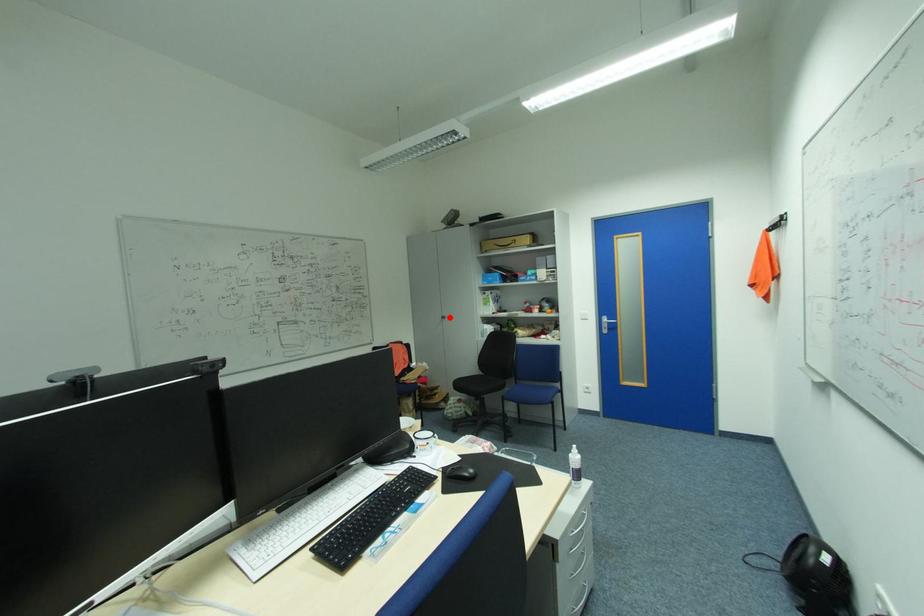
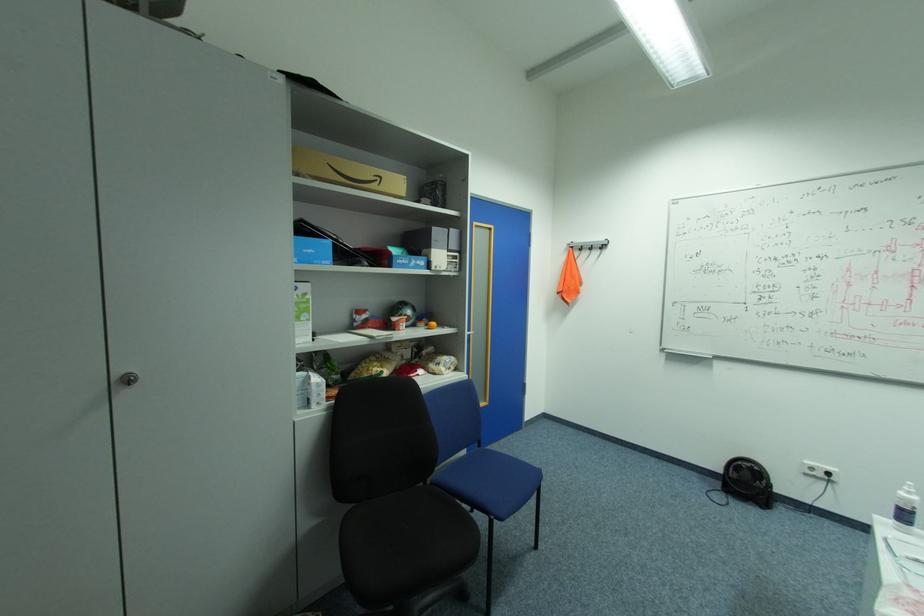
Locate, in the second image, the point that corresponds to the highlighted location in the first image.

(137, 379)